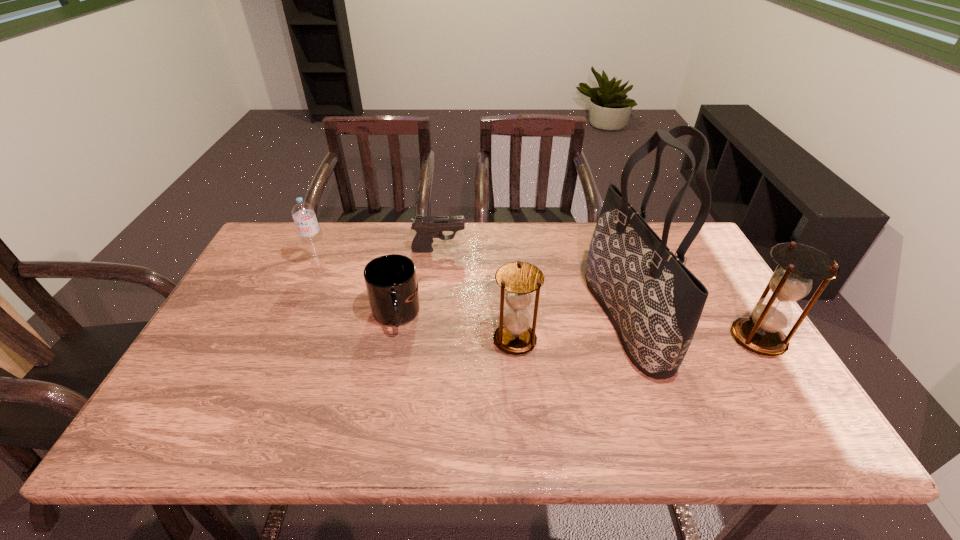
This screenshot has width=960, height=540. What are the coordinates of `blank space located 0.350m on the back of the rightmost object` in the screenshot? It's located at (698, 242).

Locate an element on the screen. blank space located 0.120m on the front of the water bottle is located at coordinates (303, 297).

Locate an element on the screen. vacant position located with the handle on the side of the mug is located at coordinates (388, 355).

I want to click on free region located 0.380m at the barrel of the farthest object, so [x=584, y=250].

The width and height of the screenshot is (960, 540). Find the location of `vacant region located on the back of the tallest object`. vacant region located on the back of the tallest object is located at coordinates (x=605, y=258).

Locate an element on the screen. The image size is (960, 540). water bottle located in the far edge section of the desktop is located at coordinates (303, 214).

Where is `pistol that is positioned at the far edge`? The image size is (960, 540). pistol that is positioned at the far edge is located at coordinates (427, 227).

Identify the location of object positioned at the near edge. This screenshot has height=540, width=960. (655, 303).

Where is `object positioned at the right edge`? This screenshot has width=960, height=540. object positioned at the right edge is located at coordinates (798, 264).

At what (x,y) coordinates should I click in order to perform the action: click on free space at the far edge of the desktop. Please return your answer as a coordinate pair (x, y). This screenshot has height=540, width=960. Looking at the image, I should click on (445, 250).